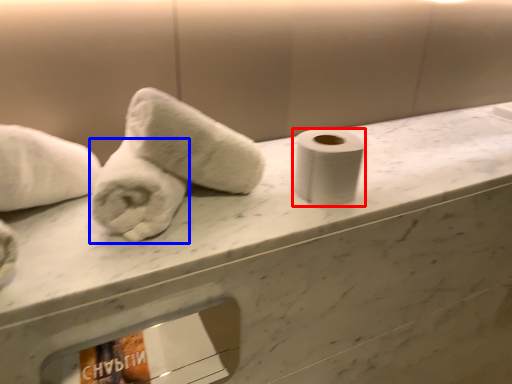
Question: Which object appears closest to the camera in this image, toilet paper (highlighted by a red box) or towel (highlighted by a blue box)?

Choices:
 (A) toilet paper
 (B) towel

Answer: (B)